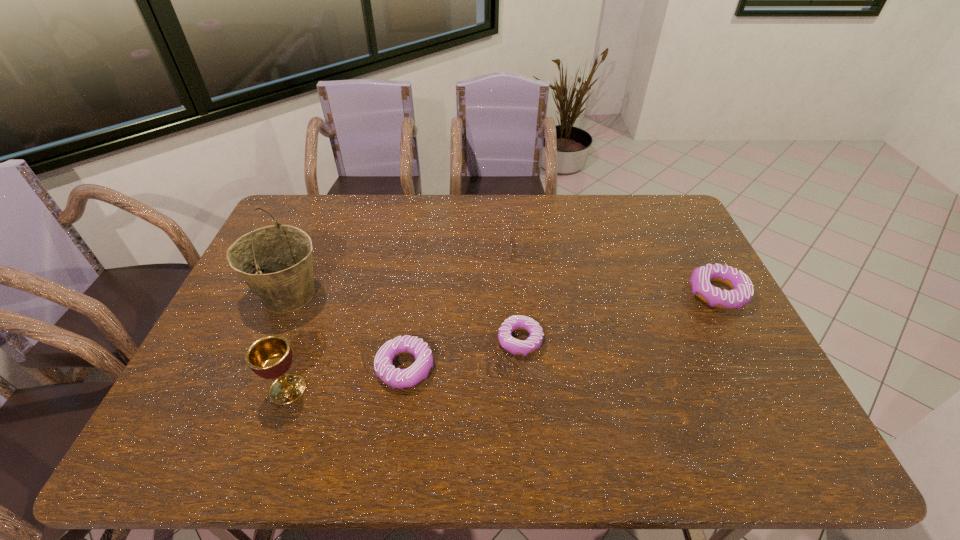
This screenshot has width=960, height=540. I want to click on vacant space situated 0.290m on the left of the shortest object, so click(x=392, y=340).

At what (x,y) coordinates should I click in order to perform the action: click on vacant region located on the back of the rightmost object. Please return your answer as a coordinate pair (x, y). The width and height of the screenshot is (960, 540). Looking at the image, I should click on (697, 255).

What are the coordinates of `free space located 0.280m on the temples of the spectacles` in the screenshot? It's located at (424, 249).

Identify the location of free space located 0.250m on the temples of the spectacles. The image size is (960, 540). (434, 249).

Find the location of a particular element. free location located 0.270m on the temples of the spectacles is located at coordinates (427, 249).

In order to click on vacant space located on the front of the tallest object in this screenshot , I will do `click(245, 399)`.

Where is `vacant space located 0.230m on the back of the fifth shortest object`? This screenshot has height=540, width=960. vacant space located 0.230m on the back of the fifth shortest object is located at coordinates (318, 306).

The height and width of the screenshot is (540, 960). What are the coordinates of `doughnut present at the near edge` in the screenshot? It's located at (394, 377).

You are a GUI agent. You are given a task and a screenshot of the screen. Output one action in this format:
    pyautogui.click(x=<x>, y=<y>)
    Task: Click on the chalice that is positioned at the near edge
    The height and width of the screenshot is (540, 960).
    Given the screenshot: What is the action you would take?
    pyautogui.click(x=270, y=357)

Find the location of `object at the left edge`. object at the left edge is located at coordinates (275, 261).